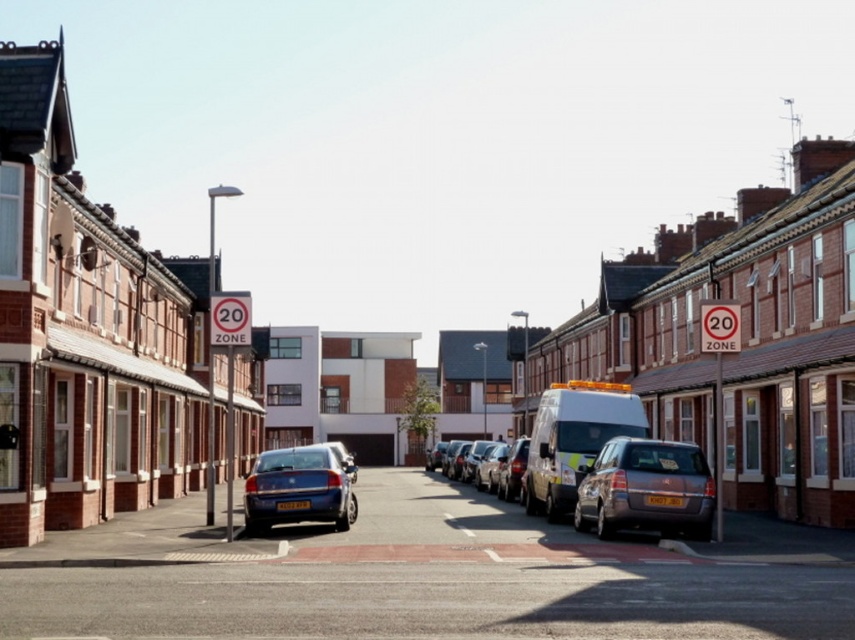
You are a pedestrian standing at the pedestrian crossing marked by the red rectangle in the middle of the street. You see a white glossy van at center and a shiny silver car at center. Which vehicle is closer to your position?

The shiny silver car at center is closer to your position because the white glossy van at center is located above it, meaning the van is further back along the street.

You are a delivery driver who needs to park your shiny silver car at center in a parking spot that can only accommodate vehicles up to the size of the silver metallic van at center. Can your car fit in the spot?

The silver metallic van at center is larger in size than the shiny silver car at center, so the shiny silver car at center should fit in the parking spot designed for the van.